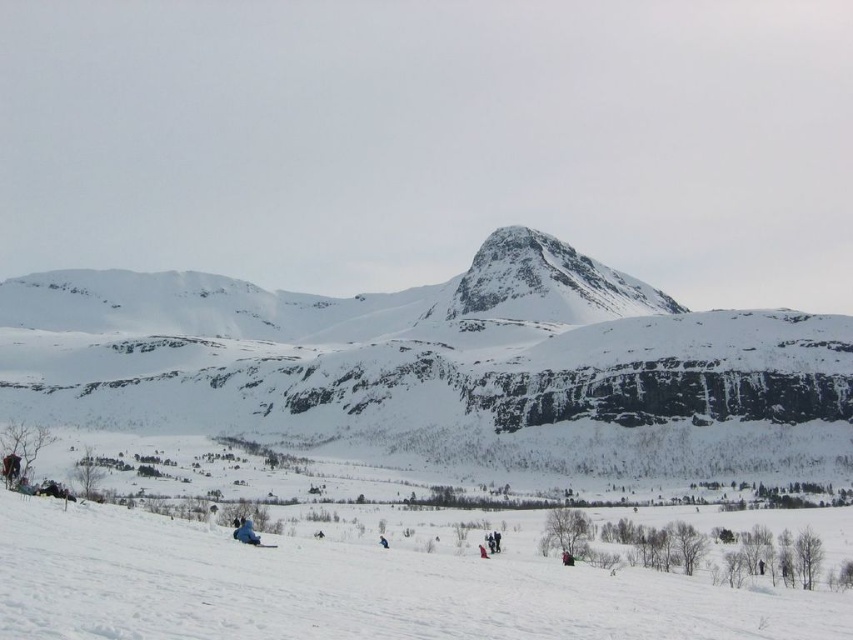
Question: Which is nearer to the blue matte ski at lower left?

Choices:
 (A) white snow-covered mountain at center
 (B) white snow ski slope at lower left

Answer: (B)

Question: Where is white snow ski slope at lower left located in relation to blue matte ski at lower left in the image?

Choices:
 (A) left
 (B) right

Answer: (B)

Question: Which point is farther to the camera?

Choices:
 (A) (177, 333)
 (B) (271, 547)

Answer: (A)

Question: Estimate the real-world distances between objects in this image. Which object is farther from the blue matte ski at lower left?

Choices:
 (A) white snow-covered mountain at center
 (B) white snow ski slope at lower left

Answer: (A)

Question: Does white snow ski slope at lower left appear on the left side of blue matte ski at lower left?

Choices:
 (A) yes
 (B) no

Answer: (B)

Question: In this image, where is white snow ski slope at lower left located relative to blue matte ski at lower left?

Choices:
 (A) above
 (B) below

Answer: (B)